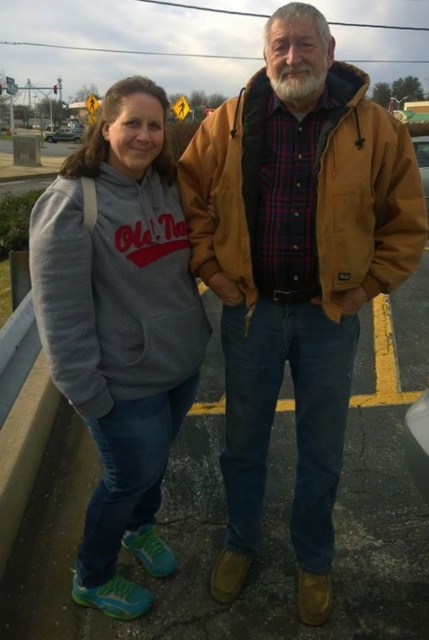
Question: Which object is the farthest from the silver metallic sedan at left?

Choices:
 (A) brown leather jacket at center
 (B) gray fleece hoodie at left

Answer: (A)

Question: Which object is the farthest from the brown leather jacket at center?

Choices:
 (A) gray fleece hoodie at left
 (B) silver metallic sedan at left

Answer: (B)

Question: Where is brown leather jacket at center located in relation to silver metallic sedan at left in the image?

Choices:
 (A) above
 (B) below

Answer: (B)

Question: Considering the relative positions of brown leather jacket at center and silver metallic sedan at left in the image provided, where is brown leather jacket at center located with respect to silver metallic sedan at left?

Choices:
 (A) below
 (B) above

Answer: (A)

Question: In this image, where is gray fleece hoodie at left located relative to silver metallic sedan at left?

Choices:
 (A) right
 (B) left

Answer: (A)

Question: Which object is positioned farthest from the gray fleece hoodie at left?

Choices:
 (A) silver metallic sedan at left
 (B) brown leather jacket at center

Answer: (A)